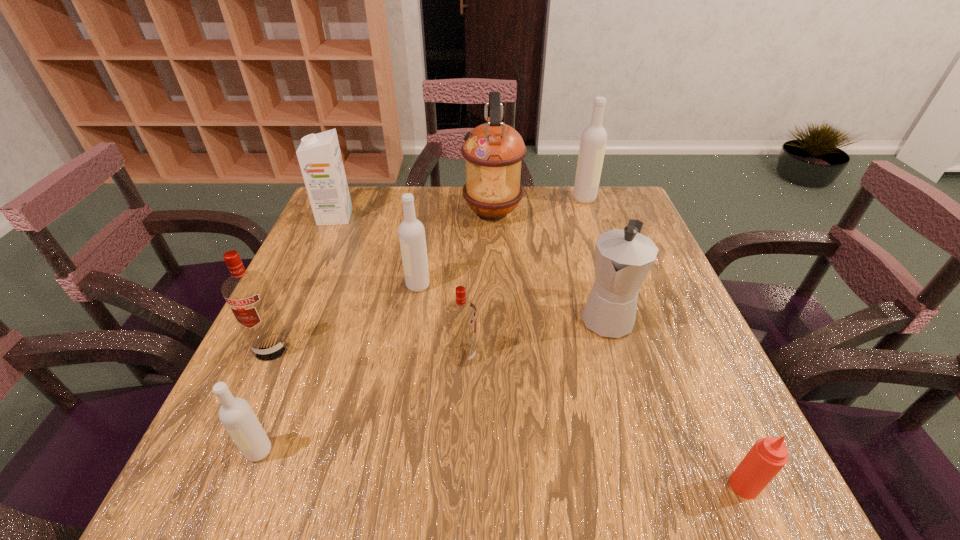
This screenshot has height=540, width=960. What are the coordinates of `vacant region located 0.080m on the front label of the fourth vodka from left to right` in the screenshot? It's located at (517, 356).

Where is `vacant point located 0.160m on the right of the smallest white vodka`? The width and height of the screenshot is (960, 540). vacant point located 0.160m on the right of the smallest white vodka is located at coordinates (370, 451).

At what (x,y) coordinates should I click in order to perform the action: click on vacant region located on the left of the nearest object. Please return your answer as a coordinate pair (x, y). Looking at the image, I should click on [608, 485].

At what (x,y) coordinates should I click in order to perform the action: click on oil lamp located in the far edge section of the desktop. Please return your answer as a coordinate pair (x, y). The image size is (960, 540). Looking at the image, I should click on click(493, 151).

Locate an element on the screen. vodka that is at the far edge is located at coordinates (593, 141).

You are a GUI agent. You are given a task and a screenshot of the screen. Output one action in this format:
    pyautogui.click(x=<x>, y=<y>)
    Task: Click on the carton that is positioned at the far edge
    
    Given the screenshot: What is the action you would take?
    pyautogui.click(x=319, y=155)

Find the location of a particular element. vodka located at the near edge is located at coordinates (236, 415).

Where is `Tabasco sauce located at the near edge`? This screenshot has height=540, width=960. Tabasco sauce located at the near edge is located at coordinates (769, 455).

The width and height of the screenshot is (960, 540). I want to click on carton that is at the left edge, so click(319, 155).

You are a GUI agent. You are given a task and a screenshot of the screen. Output one action in this format:
    pyautogui.click(x=<x>, y=<y>)
    Task: Click on the vodka that is at the right edge
    The height and width of the screenshot is (540, 960).
    Given the screenshot: What is the action you would take?
    pyautogui.click(x=593, y=141)